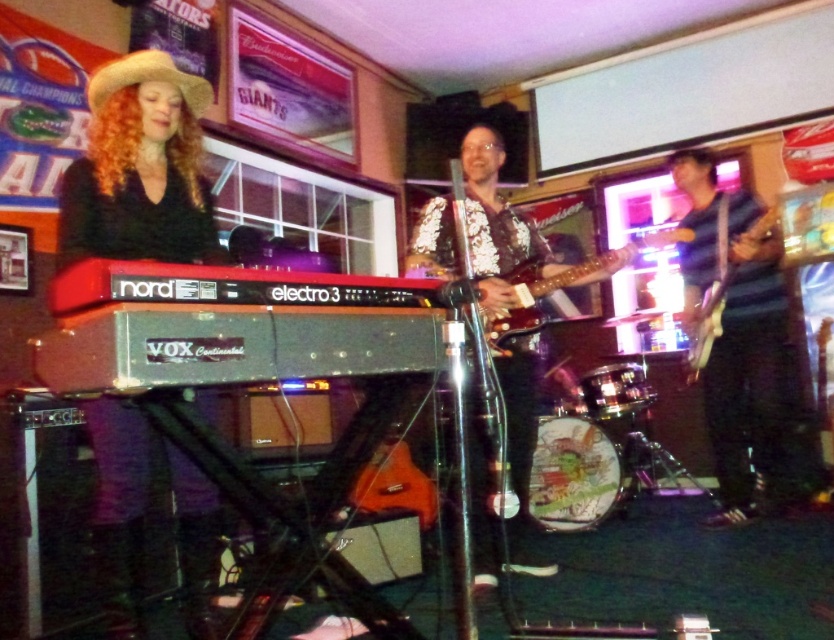
Question: Can you confirm if matte black keyboard at center is positioned to the right of glossy wood guitar at center?

Choices:
 (A) yes
 (B) no

Answer: (B)

Question: Which of the following is the closest to the observer?

Choices:
 (A) shiny sequined shirt at center
 (B) matte black keyboard at center

Answer: (B)

Question: Which object is positioned farthest from the shiny silver guitar at right?

Choices:
 (A) matte black keyboard at center
 (B) glossy wood guitar at center
 (C) shiny black electric guitar at right

Answer: (A)

Question: Among these objects, which one is farthest from the camera?

Choices:
 (A) shiny black electric guitar at right
 (B) matte black keyboard at center
 (C) shiny silver guitar at right
 (D) glossy wood guitar at center

Answer: (C)

Question: Can you confirm if matte black keyboard at center is thinner than shiny black electric guitar at right?

Choices:
 (A) no
 (B) yes

Answer: (A)

Question: Can you confirm if glossy wood guitar at center is positioned above shiny black electric guitar at right?

Choices:
 (A) no
 (B) yes

Answer: (B)